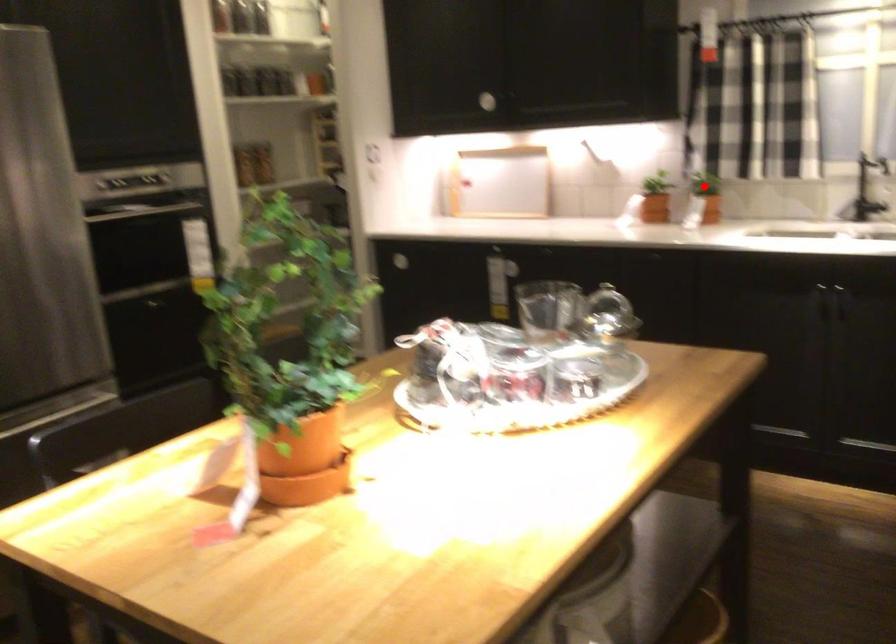
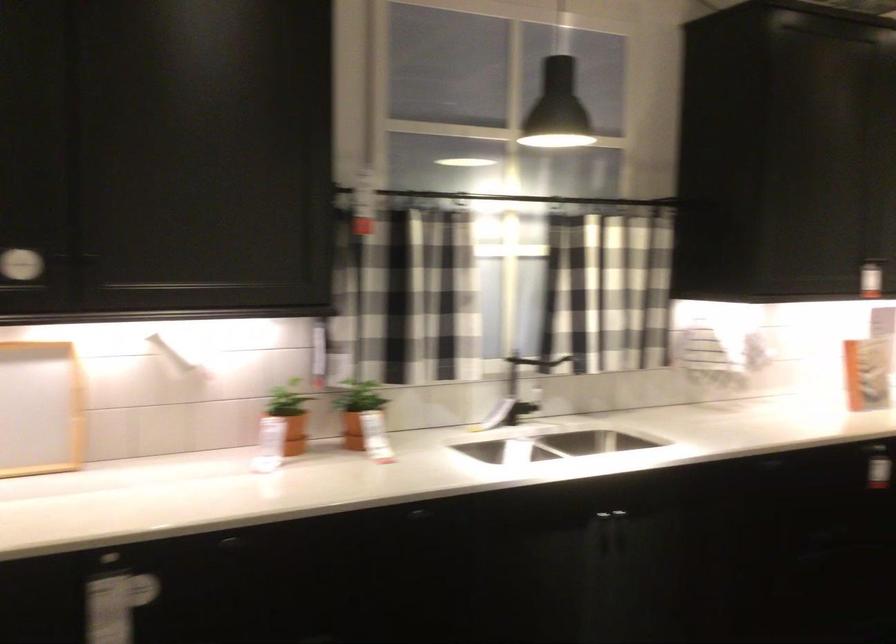
Question: I am providing you with two images of the same scene from different viewpoints. Given a red point in image1, look at the same physical point in image2. Is it:

Choices:
 (A) Closer to the viewpoint
 (B) Farther from the viewpoint

Answer: (A)